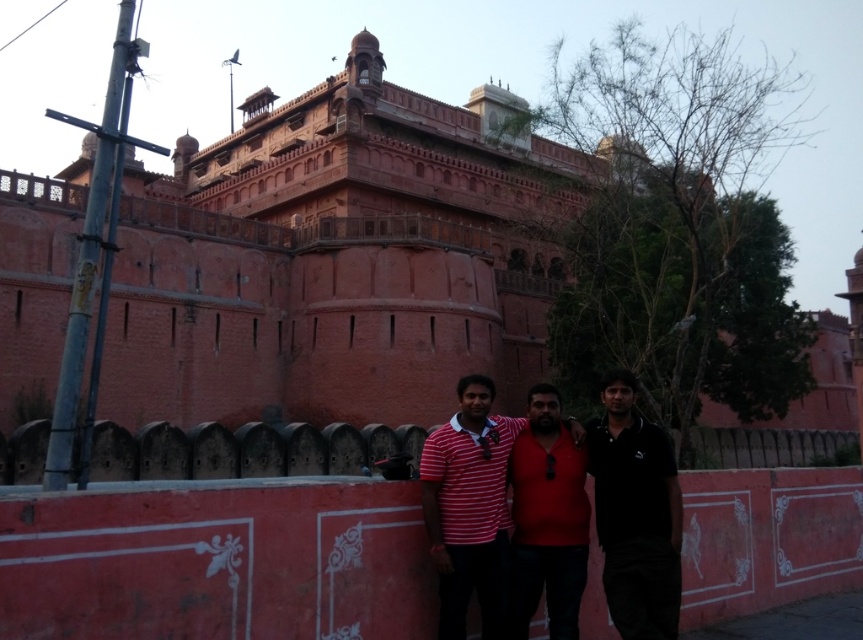
Can you confirm if black matte shirt at center is taller than matte red shirt at center?

Correct, black matte shirt at center is much taller as matte red shirt at center.

Between black matte shirt at center and matte red shirt at center, which one has less height?

With less height is matte red shirt at center.

What do you see at coordinates (635, 513) in the screenshot? The height and width of the screenshot is (640, 863). I see `black matte shirt at center` at bounding box center [635, 513].

This screenshot has height=640, width=863. Find the location of `black matte shirt at center`. black matte shirt at center is located at coordinates point(635,513).

Is red striped shirt at center to the right of black matte shirt at center from the viewer's perspective?

In fact, red striped shirt at center is to the left of black matte shirt at center.

Does point (562, 426) come closer to viewer compared to point (660, 464)?

That is False.

This screenshot has height=640, width=863. I want to click on red striped shirt at center, so click(x=545, y=524).

Measure the distance between red striped shirt at center and matte red shirt at center.

red striped shirt at center is 3.32 feet from matte red shirt at center.

Is point (430, 452) positioned behind point (521, 593)?

That is True.

At what (x,y) coordinates should I click in order to perform the action: click on red striped shirt at center. Please return your answer as a coordinate pair (x, y). The width and height of the screenshot is (863, 640). Looking at the image, I should click on (545, 524).

Identify the location of red striped shirt at center. Image resolution: width=863 pixels, height=640 pixels. (545, 524).